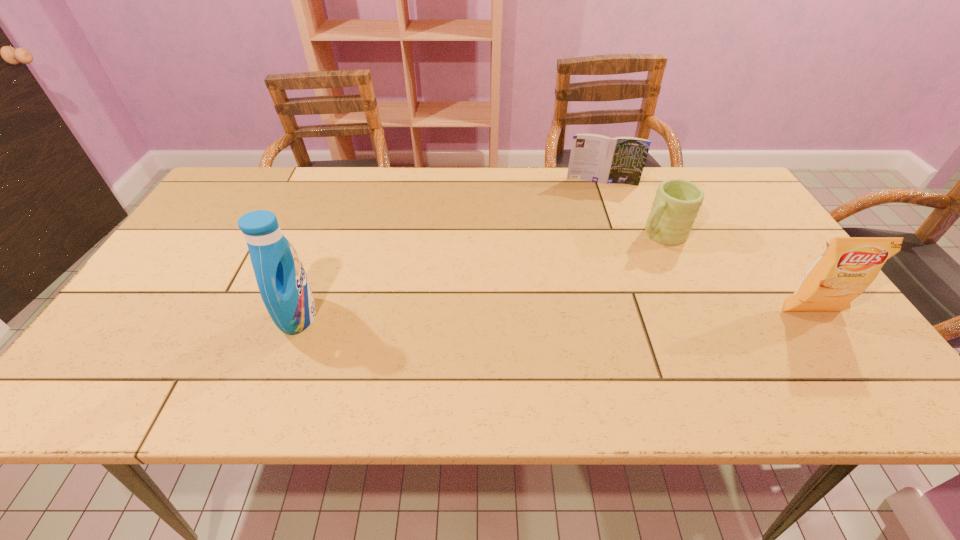
At what (x,y) coordinates should I click in order to perform the action: click on the tallest object. Please return your answer as a coordinate pair (x, y). This screenshot has width=960, height=540. Looking at the image, I should click on (282, 281).

Identify the location of the leftmost object. This screenshot has height=540, width=960. (282, 281).

Identify the location of the second tallest object. The height and width of the screenshot is (540, 960). (x=849, y=265).

I want to click on the rightmost object, so (849, 265).

Where is `the second farthest object`? the second farthest object is located at coordinates (677, 202).

I want to click on book, so click(596, 158).

Find the location of a particular element. The width and height of the screenshot is (960, 540). free space located on the front-facing side of the leftmost object is located at coordinates (489, 316).

Find the location of `vacant space situated 0.060m on the front of the crisp (potato chip) with the logo`. vacant space situated 0.060m on the front of the crisp (potato chip) with the logo is located at coordinates (831, 341).

This screenshot has height=540, width=960. Identify the location of free location located 0.140m on the side of the second farthest object with the handle. (607, 263).

I want to click on free point located on the side of the second farthest object with the handle, so point(587,274).